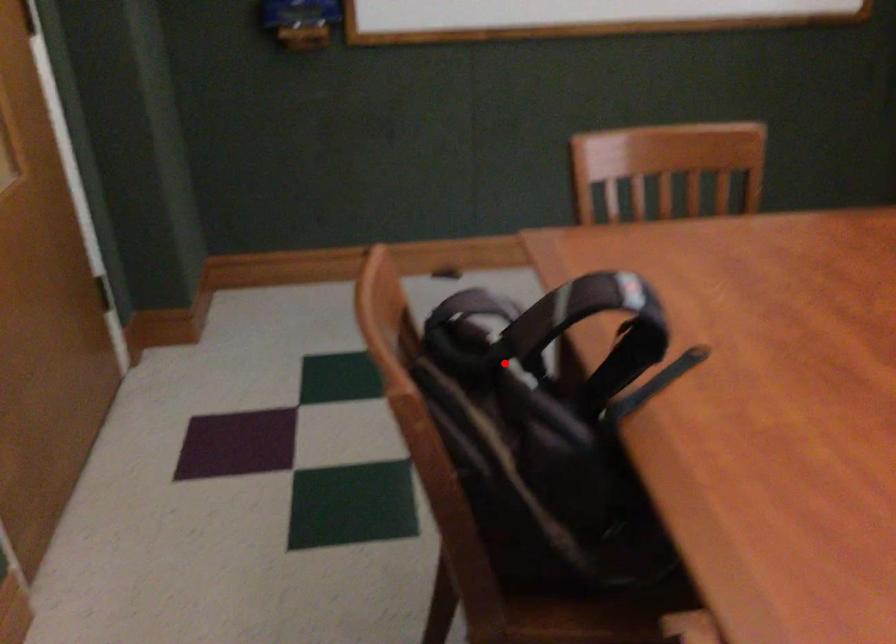
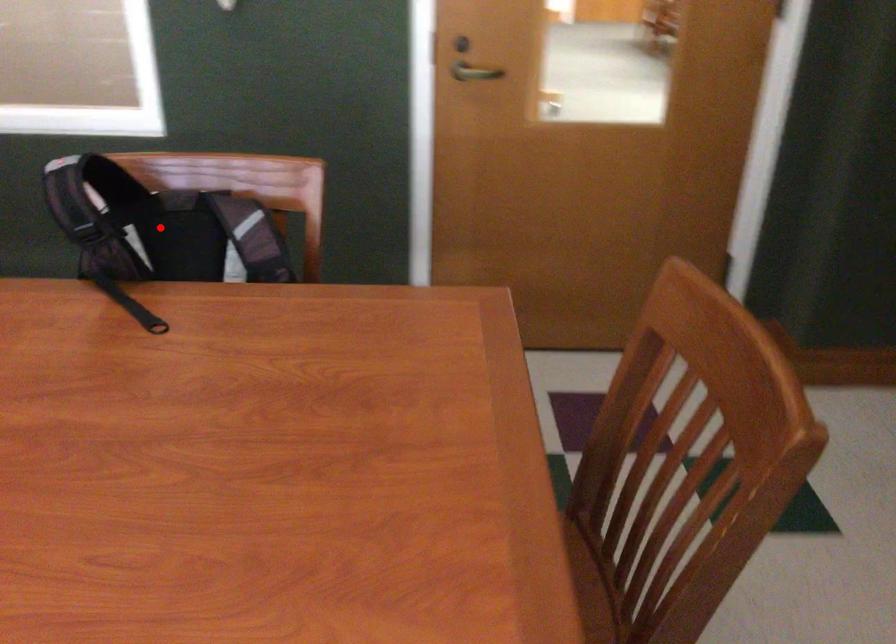
I am providing you with two images of the same scene from different viewpoints. A red point is marked on the first image and another point is marked on the second image. Is the marked point in image1 the same physical position as the marked point in image2?

Yes